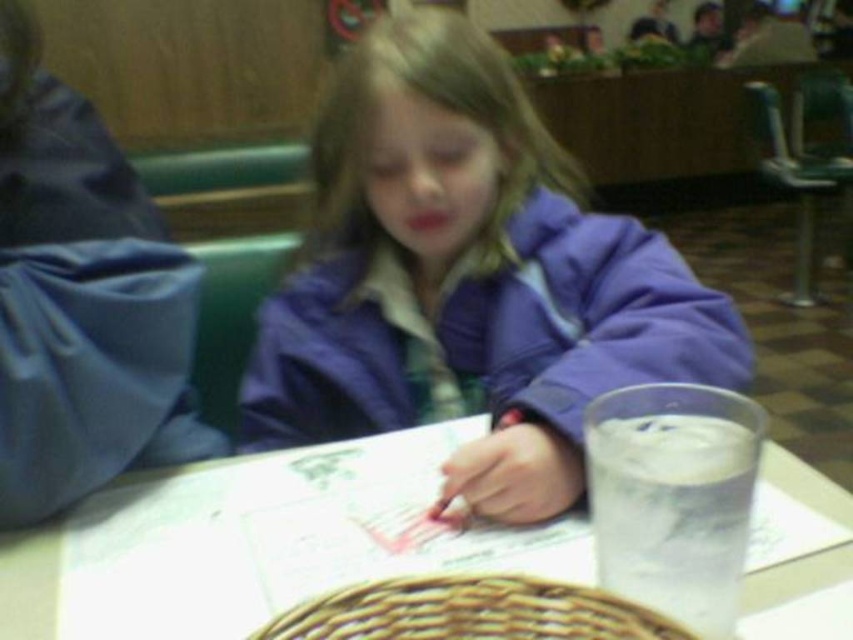
Question: Which of the following is the closest to the observer?

Choices:
 (A) white glossy table at center
 (B) purple matte jacket at center

Answer: (A)

Question: Which object is farther from the camera taking this photo?

Choices:
 (A) purple matte jacket at center
 (B) white glossy table at center

Answer: (A)

Question: Observing the image, what is the correct spatial positioning of purple matte jacket at center in reference to white glossy table at center?

Choices:
 (A) above
 (B) below

Answer: (A)

Question: Is purple matte jacket at center above white glossy table at center?

Choices:
 (A) no
 (B) yes

Answer: (B)

Question: Observing the image, what is the correct spatial positioning of purple matte jacket at center in reference to white glossy table at center?

Choices:
 (A) left
 (B) right

Answer: (B)

Question: Which point is closer to the camera?

Choices:
 (A) purple matte jacket at center
 (B) white glossy table at center

Answer: (B)